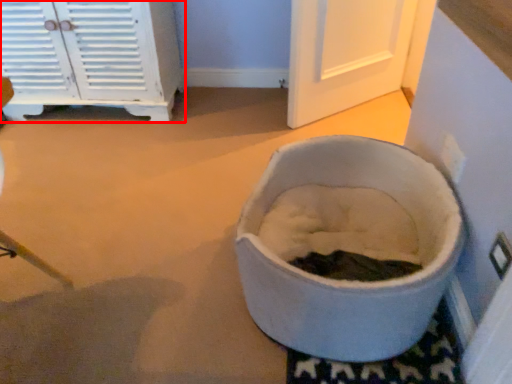
Question: From the image's perspective, where is cabinetry (annotated by the red box) located relative to toilet?

Choices:
 (A) above
 (B) below

Answer: (A)